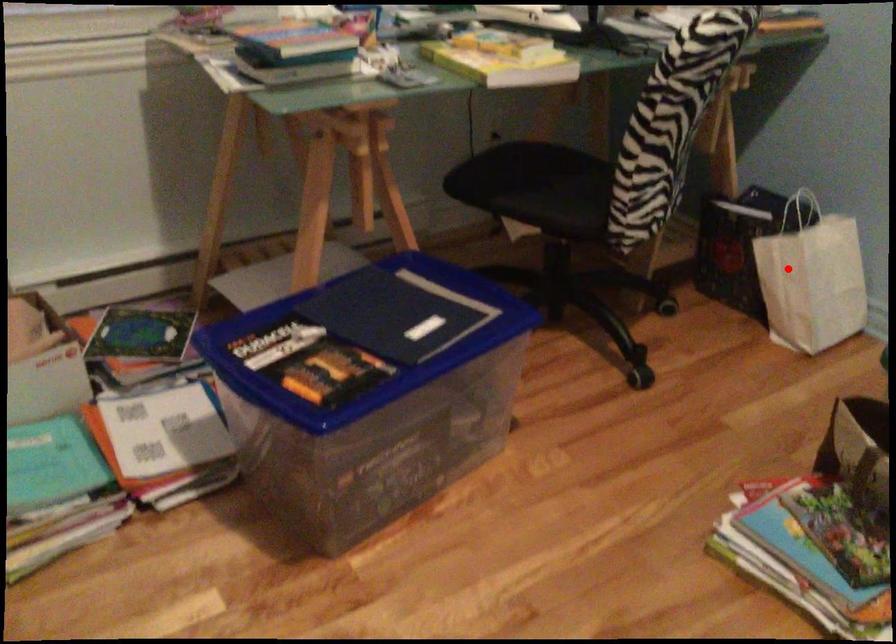
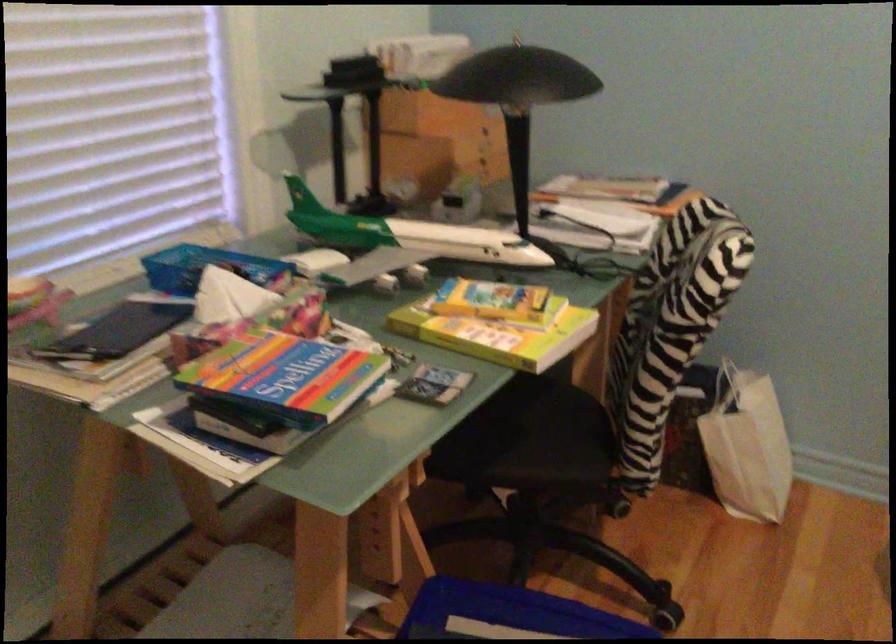
Find the pixel in the second image that matches the highlighted location in the first image.

(746, 446)